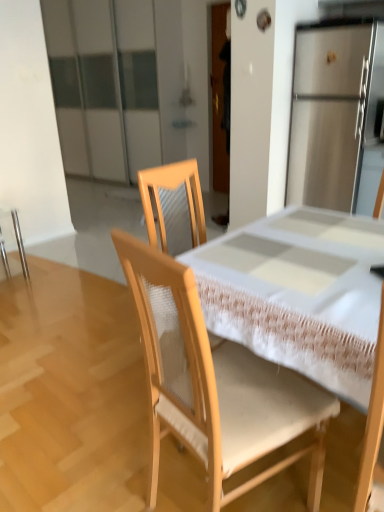
Question: Considering the positions of wooden chair at center, the 2th chair viewed from the back, and metallic silver chair at left, which is the 2th chair in right-to-left order, in the image, is wooden chair at center, the 2th chair viewed from the back, wider or thinner than metallic silver chair at left, which is the 2th chair in right-to-left order,?

Choices:
 (A) thin
 (B) wide

Answer: (B)

Question: Is point (147, 246) positioned closer to the camera than point (23, 270)?

Choices:
 (A) farther
 (B) closer

Answer: (B)

Question: From the image's perspective, relative to metallic silver chair at left, the 1th chair positioned from the left, is wooden chair at center, which is the 1th chair in front-to-back order, above or below?

Choices:
 (A) above
 (B) below

Answer: (B)

Question: Considering the positions of point (3, 245) and point (163, 335), is point (3, 245) closer or farther from the camera than point (163, 335)?

Choices:
 (A) closer
 (B) farther

Answer: (B)

Question: In terms of width, does metallic silver chair at left, which is counted as the second chair, starting from the front, look wider or thinner when compared to wooden chair at center, which is the 1th chair in front-to-back order?

Choices:
 (A) wide
 (B) thin

Answer: (B)

Question: In the image, is metallic silver chair at left, which is counted as the second chair, starting from the front, on the left side or the right side of wooden chair at center, positioned as the 2th chair in left-to-right order?

Choices:
 (A) left
 (B) right

Answer: (A)

Question: From the image's perspective, is metallic silver chair at left, the 1th chair positioned from the left, positioned above or below wooden chair at center, the 2th chair viewed from the back?

Choices:
 (A) below
 (B) above

Answer: (B)